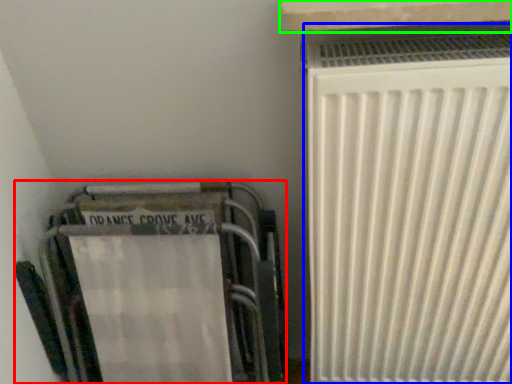
Question: Which object is positioned closest to furniture (highlighted by a red box)? Select from radiator (highlighted by a blue box) and window sill (highlighted by a green box).

Choices:
 (A) radiator
 (B) window sill

Answer: (A)